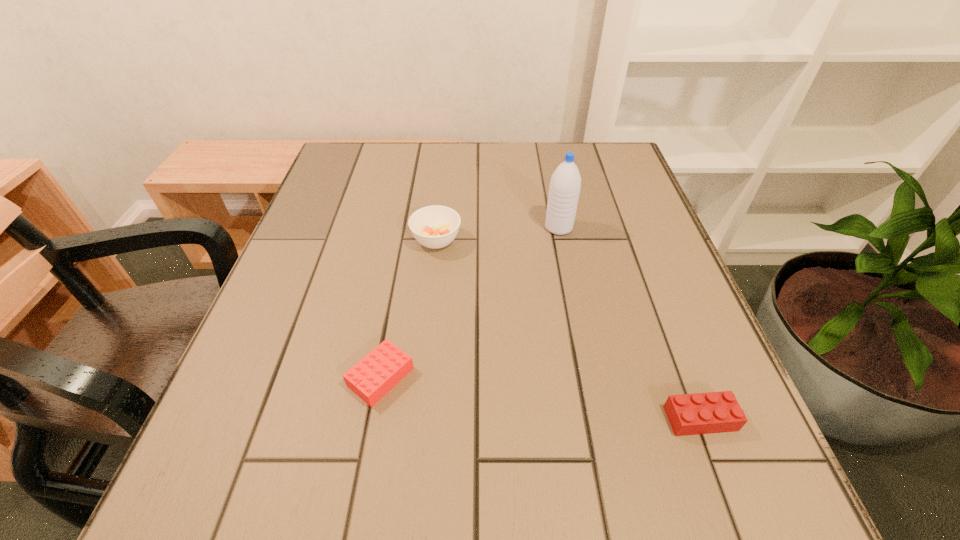
The height and width of the screenshot is (540, 960). I want to click on free location at the far edge, so click(484, 163).

In the image, there is a desktop. In order to click on vacant space at the near edge in this screenshot , I will do `click(510, 531)`.

At what (x,y) coordinates should I click in order to perform the action: click on vacant space at the left edge. Please return your answer as a coordinate pair (x, y). The image size is (960, 540). Looking at the image, I should click on (310, 235).

Locate an element on the screen. Image resolution: width=960 pixels, height=540 pixels. free space at the right edge is located at coordinates (617, 301).

Find the location of a particular element. The width and height of the screenshot is (960, 540). free spot at the far left corner of the desktop is located at coordinates (338, 152).

Identify the location of blank space at the near left corner. (184, 497).

Identify the location of empty space between the tallest object and the right Lego. The width and height of the screenshot is (960, 540). (630, 323).

Where is `empty space that is in between the soup bowl and the third object from left to right`? This screenshot has height=540, width=960. empty space that is in between the soup bowl and the third object from left to right is located at coordinates (497, 234).

Where is `vacant area that lies between the tallest object and the right Lego`? This screenshot has height=540, width=960. vacant area that lies between the tallest object and the right Lego is located at coordinates (630, 323).

I want to click on free space between the second object from right to left and the left Lego, so click(469, 302).